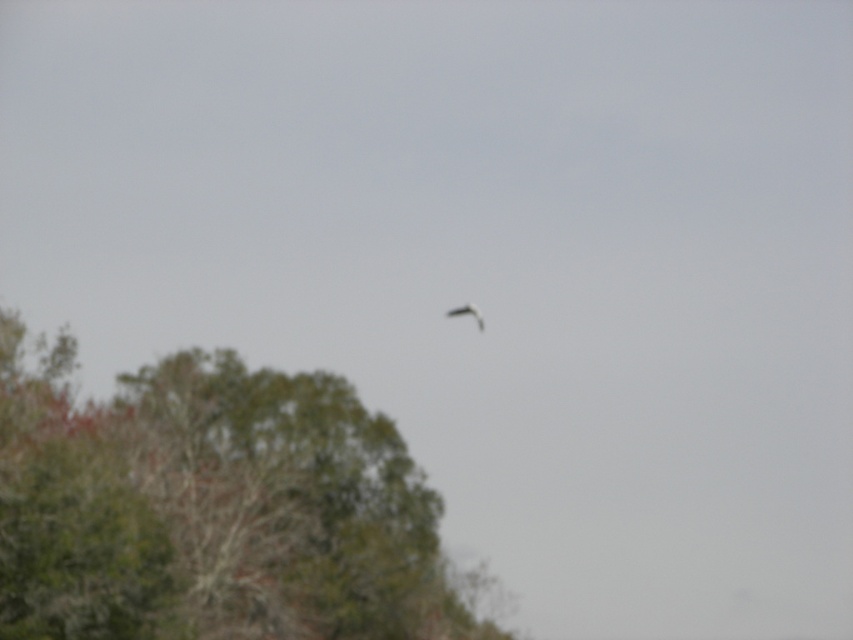
You are an ornithologist observing a bird in a forest. You see a green leafy tree at lower left and a smooth gray bird at center. Which object is taller?

The green leafy tree at lower left is taller than the smooth gray bird at center.